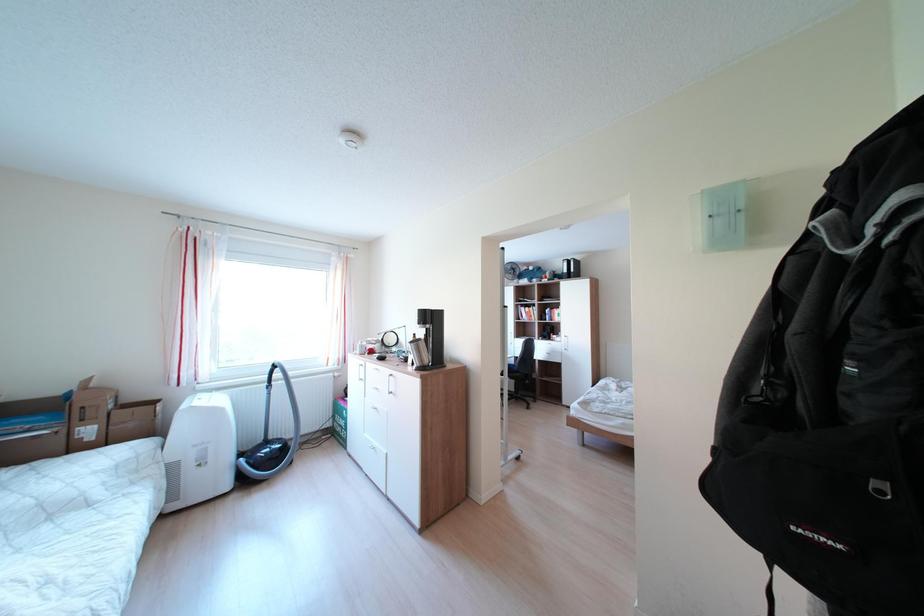
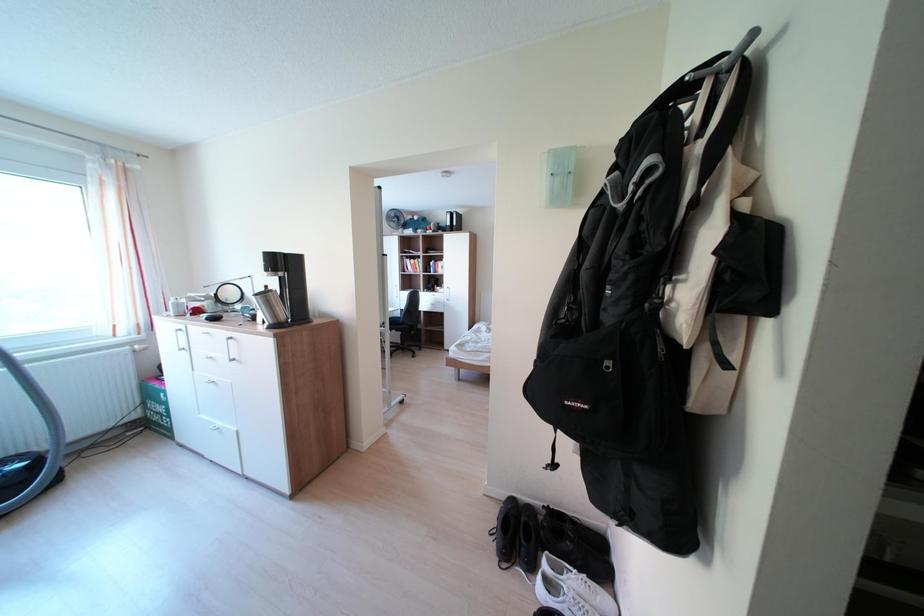
The images are taken continuously from a first-person perspective. In which direction are you moving?

The cameraman walked toward right, forward.